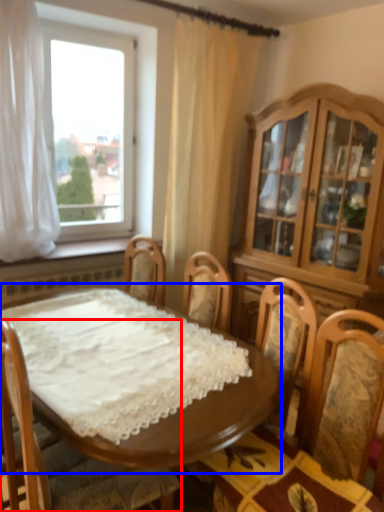
Question: Which object is closer to the camera taking this photo, chair (highlighted by a red box) or table (highlighted by a blue box)?

Choices:
 (A) chair
 (B) table

Answer: (A)